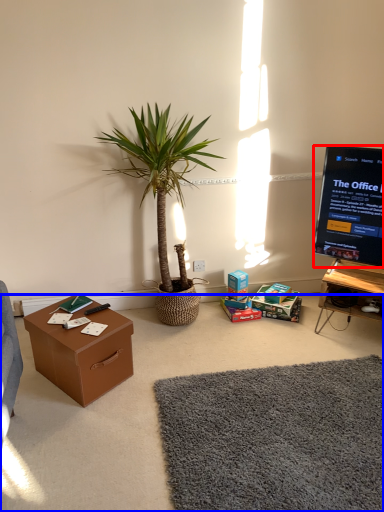
Question: Which of the following is the closest to the observer, television (highlighted by a red box) or plain (highlighted by a blue box)?

Choices:
 (A) television
 (B) plain

Answer: (B)